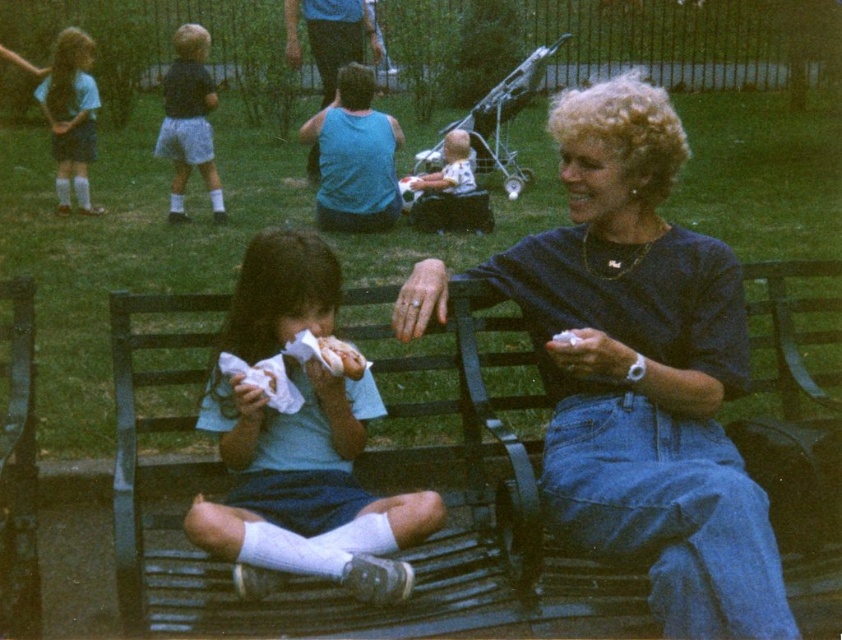
Question: Among these points, which one is nearest to the camera?

Choices:
 (A) (56, 124)
 (B) (212, 193)
 (C) (264, 266)
 (D) (582, 189)

Answer: (C)

Question: Where is white cotton shirt at center located in relation to matte blue shorts at left in the image?

Choices:
 (A) above
 (B) below

Answer: (B)

Question: Considering the real-world distances, which object is farthest from the matte blue shorts at upper left?

Choices:
 (A) dark blue shirt at center
 (B) white cotton shirt at center
 (C) matte blue shorts at left

Answer: (A)

Question: Which object appears farthest from the camera in this image?

Choices:
 (A) dark blue shirt at center
 (B) matte blue shorts at upper left

Answer: (B)

Question: Is dark blue shirt at center behind matte blue shorts at left?

Choices:
 (A) no
 (B) yes

Answer: (A)

Question: Is dark blue shirt at center bigger than white cotton shirt at center?

Choices:
 (A) yes
 (B) no

Answer: (A)